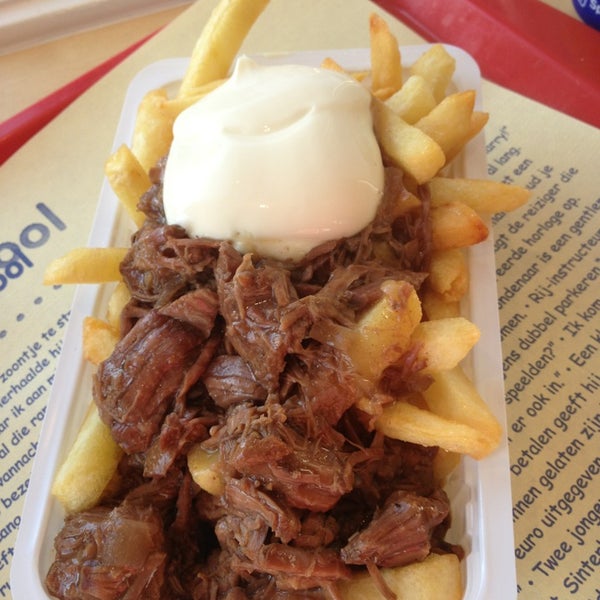
Image resolution: width=600 pixels, height=600 pixels. Identify the location of tray on the top right. (539, 61).